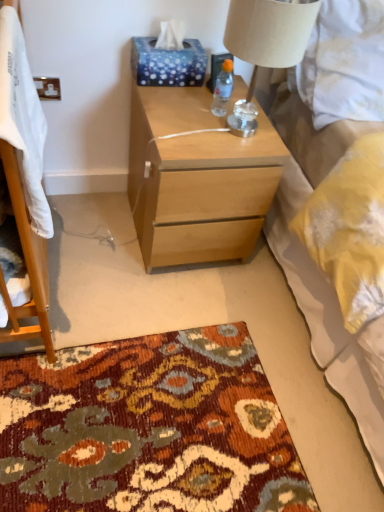
Question: Are white soft blanket at left and beige fabric lampshade at upper right far apart?

Choices:
 (A) no
 (B) yes

Answer: (A)

Question: Is white soft blanket at left oriented towards beige fabric lampshade at upper right?

Choices:
 (A) no
 (B) yes

Answer: (A)

Question: Is white soft blanket at left bigger than beige fabric lampshade at upper right?

Choices:
 (A) no
 (B) yes

Answer: (A)

Question: Is beige fabric lampshade at upper right at the back of white soft blanket at left?

Choices:
 (A) no
 (B) yes

Answer: (B)

Question: Considering the relative sizes of white soft blanket at left and beige fabric lampshade at upper right in the image provided, is white soft blanket at left wider than beige fabric lampshade at upper right?

Choices:
 (A) no
 (B) yes

Answer: (A)

Question: From a real-world perspective, is white soft blanket at left positioned over beige fabric lampshade at upper right based on gravity?

Choices:
 (A) no
 (B) yes

Answer: (A)

Question: Does white soft blanket at left have a smaller size compared to blue dotted tissue at upper center?

Choices:
 (A) yes
 (B) no

Answer: (B)

Question: Does white soft blanket at left come behind blue dotted tissue at upper center?

Choices:
 (A) no
 (B) yes

Answer: (A)

Question: Considering the relative sizes of white soft blanket at left and blue dotted tissue at upper center in the image provided, is white soft blanket at left thinner than blue dotted tissue at upper center?

Choices:
 (A) no
 (B) yes

Answer: (A)

Question: Is white soft blanket at left turned away from blue dotted tissue at upper center?

Choices:
 (A) yes
 (B) no

Answer: (B)

Question: Is white soft blanket at left aimed at blue dotted tissue at upper center?

Choices:
 (A) no
 (B) yes

Answer: (A)

Question: Considering the relative positions of white soft blanket at left and blue dotted tissue at upper center in the image provided, is white soft blanket at left to the right of blue dotted tissue at upper center from the viewer's perspective?

Choices:
 (A) yes
 (B) no

Answer: (B)

Question: Does blue dotted tissue at upper center appear on the left side of white soft blanket at left?

Choices:
 (A) no
 (B) yes

Answer: (A)